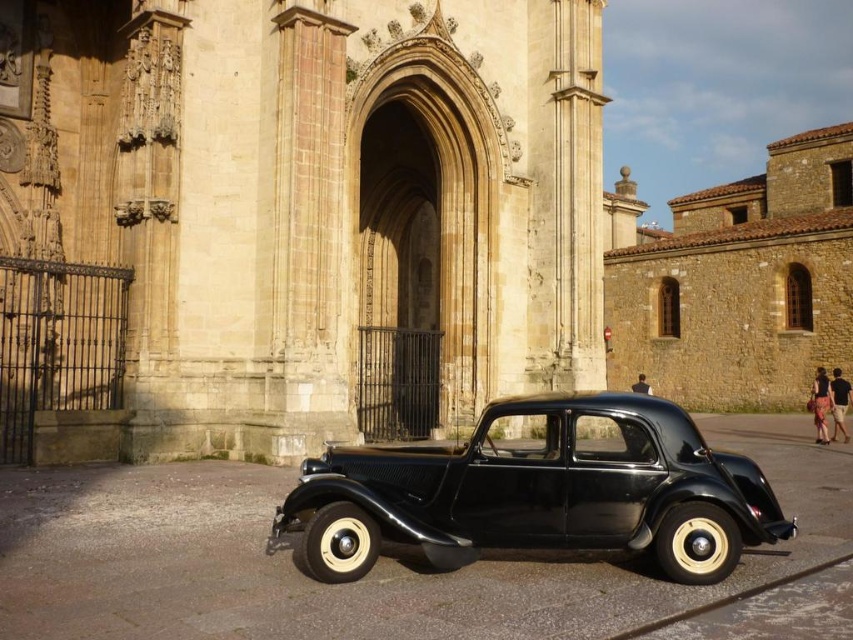
You are standing in front of the beige stone church at center and the shiny black car at center. Which object is positioned higher in the image?

The beige stone church at center is positioned higher than the shiny black car at center in the image.

You are a photographer standing in front of the shiny black car at center and the brown stone church at right. You want to take a photo that includes both the car and the church in the background. Which object should be closer to the camera to ensure the church is visible in the background?

The shiny black car at center is in front of the brown stone church at right, so to have the church in the background, the car should be closer to the camera while the church remains further back.